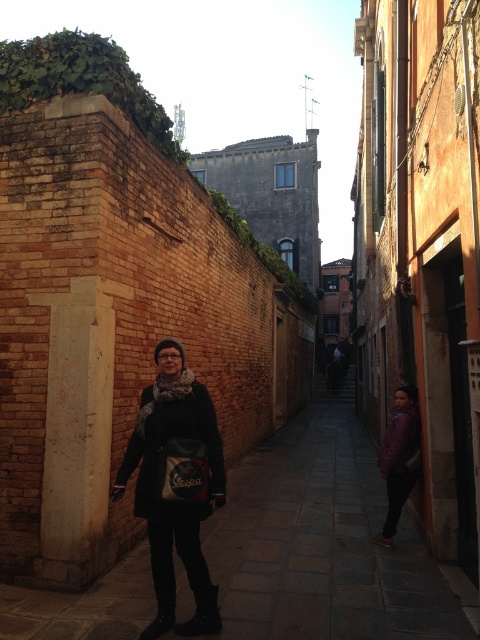
From the picture: Can you confirm if dark stone pavement at center is smaller than purple matte jacket at lower right?

No.

Is point (300, 524) in front of point (394, 472)?

No, it is not.

Identify the location of dark stone pavement at center. The image size is (480, 640). (322, 541).

Can you confirm if matte black coat at center is positioned to the left of purple matte jacket at lower right?

Indeed, matte black coat at center is positioned on the left side of purple matte jacket at lower right.

Locate an element on the screen. This screenshot has width=480, height=640. matte black coat at center is located at coordinates (181, 480).

Locate an element on the screen. The width and height of the screenshot is (480, 640). matte black coat at center is located at coordinates (181, 480).

Who is positioned more to the right, dark stone pavement at center or matte black coat at center?

dark stone pavement at center

Between point (144, 550) and point (157, 472), which one is positioned in front?

Positioned in front is point (157, 472).

Identify the location of dark stone pavement at center. (322, 541).